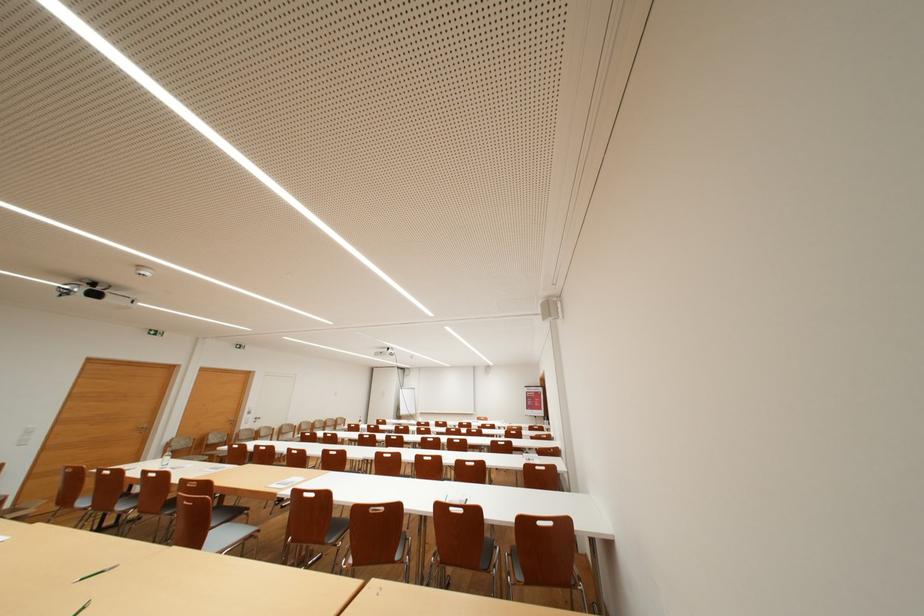
Where would you lift the small glass bottle? Please return your answer as a coordinate pair (x, y).

(165, 456)